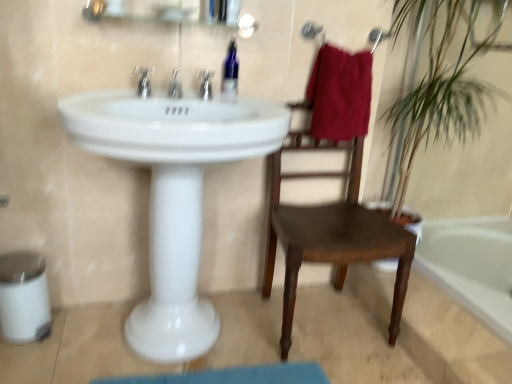
Question: Which direction should I rotate to look at silver metallic faucet at upper center, positioned as the first tap in left-to-right order, — up or down?

Choices:
 (A) up
 (B) down

Answer: (A)

Question: Can you confirm if matte silver faucet at center, which is the 3th tap from left to right, is smaller than white glossy sink at center?

Choices:
 (A) yes
 (B) no

Answer: (A)

Question: From a real-world perspective, does matte silver faucet at center, which is the 1th tap in right-to-left order, stand above white glossy sink at center?

Choices:
 (A) no
 (B) yes

Answer: (B)

Question: Is matte silver faucet at center, which is the 1th tap in right-to-left order, bigger than white glossy sink at center?

Choices:
 (A) no
 (B) yes

Answer: (A)

Question: Is matte silver faucet at center, which is the 3th tap from left to right, positioned beyond the bounds of white glossy sink at center?

Choices:
 (A) no
 (B) yes

Answer: (B)

Question: Could you tell me if matte silver faucet at center, which is the 1th tap in right-to-left order, is turned towards white glossy sink at center?

Choices:
 (A) no
 (B) yes

Answer: (A)

Question: Is matte silver faucet at center, which is the 1th tap in right-to-left order, to the right of white glossy sink at center from the viewer's perspective?

Choices:
 (A) no
 (B) yes

Answer: (B)

Question: Can you confirm if white glossy bathtub at lower right is shorter than metallic glass medicine cabinet at upper center?

Choices:
 (A) yes
 (B) no

Answer: (B)

Question: From the image's perspective, is white glossy bathtub at lower right under metallic glass medicine cabinet at upper center?

Choices:
 (A) yes
 (B) no

Answer: (A)

Question: Is white glossy bathtub at lower right located outside metallic glass medicine cabinet at upper center?

Choices:
 (A) no
 (B) yes

Answer: (B)

Question: Is white glossy bathtub at lower right aimed at metallic glass medicine cabinet at upper center?

Choices:
 (A) yes
 (B) no

Answer: (B)

Question: From a real-world perspective, is white glossy bathtub at lower right below metallic glass medicine cabinet at upper center?

Choices:
 (A) yes
 (B) no

Answer: (A)

Question: Is white glossy bathtub at lower right to the left of metallic glass medicine cabinet at upper center from the viewer's perspective?

Choices:
 (A) yes
 (B) no

Answer: (B)

Question: Does metallic glass medicine cabinet at upper center have a greater width compared to white glossy sink at center?

Choices:
 (A) no
 (B) yes

Answer: (A)